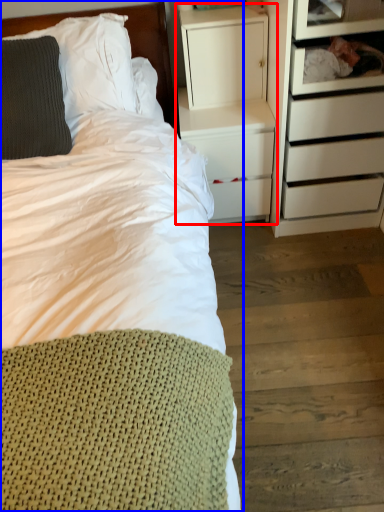
Question: Which point is further to the camera, nightstand (highlighted by a red box) or bed (highlighted by a blue box)?

Choices:
 (A) nightstand
 (B) bed

Answer: (A)